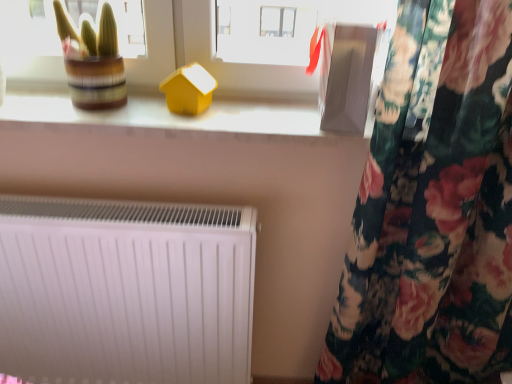
Question: Is matte yellow house at upper center positioned with its back to matte yellow house at center?

Choices:
 (A) no
 (B) yes

Answer: (A)

Question: Is matte yellow house at upper center in front of matte yellow house at center?

Choices:
 (A) yes
 (B) no

Answer: (A)

Question: Is matte yellow house at upper center shorter than matte yellow house at center?

Choices:
 (A) yes
 (B) no

Answer: (A)

Question: Is matte yellow house at upper center next to matte yellow house at center and touching it?

Choices:
 (A) yes
 (B) no

Answer: (B)

Question: Could you tell me if matte yellow house at upper center is turned towards matte yellow house at center?

Choices:
 (A) yes
 (B) no

Answer: (B)

Question: From a real-world perspective, is matte yellow house at upper center physically above matte yellow house at center?

Choices:
 (A) yes
 (B) no

Answer: (B)

Question: Is matte yellow house at center oriented towards green striped pot at upper left?

Choices:
 (A) yes
 (B) no

Answer: (B)

Question: Considering the relative positions of matte yellow house at center and green striped pot at upper left in the image provided, is matte yellow house at center in front of green striped pot at upper left?

Choices:
 (A) yes
 (B) no

Answer: (B)

Question: Can you confirm if matte yellow house at center is positioned to the left of green striped pot at upper left?

Choices:
 (A) no
 (B) yes

Answer: (A)

Question: Is matte yellow house at center behind green striped pot at upper left?

Choices:
 (A) yes
 (B) no

Answer: (A)

Question: Is matte yellow house at center at the right side of green striped pot at upper left?

Choices:
 (A) yes
 (B) no

Answer: (A)

Question: Is matte yellow house at center wider than green striped pot at upper left?

Choices:
 (A) no
 (B) yes

Answer: (A)

Question: Is matte yellow house at upper center surrounded by white matte radiator at lower left?

Choices:
 (A) yes
 (B) no

Answer: (B)